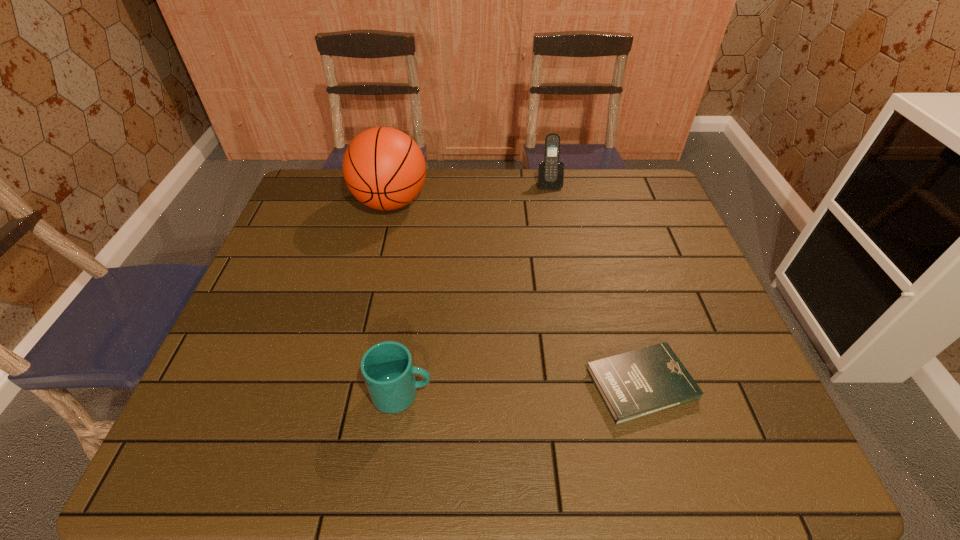
This screenshot has height=540, width=960. I want to click on free space between the cup and the book, so click(x=521, y=389).

You are a GUI agent. You are given a task and a screenshot of the screen. Output one action in this format:
    pyautogui.click(x=<x>, y=<y>)
    Task: Click on the free space between the cup and the basketball
    
    Given the screenshot: What is the action you would take?
    pyautogui.click(x=396, y=298)

The image size is (960, 540). I want to click on vacant area that lies between the tallest object and the cup, so click(x=396, y=298).

Locate an element on the screen. free space between the cellular telephone and the second shortest object is located at coordinates (475, 288).

Image resolution: width=960 pixels, height=540 pixels. Identify the location of unoccupied position between the cup and the tallest object. (396, 298).

The width and height of the screenshot is (960, 540). I want to click on free space between the basketball and the shortest object, so click(516, 293).

The width and height of the screenshot is (960, 540). Identify the location of the third closest object to the third tallest object. (550, 172).

The width and height of the screenshot is (960, 540). Find the location of `object that stands as the third closest to the shortest object`. object that stands as the third closest to the shortest object is located at coordinates (550, 172).

The height and width of the screenshot is (540, 960). I want to click on vacant position in the image that satisfies the following two spatial constraints: 1. on the front-facing side of the shortest object; 2. on the left side of the third shortest object, so click(x=587, y=384).

At what (x,y) coordinates should I click in order to perform the action: click on vacant region that satisfies the following two spatial constraints: 1. on the front-facing side of the cellular telephone; 2. on the handle side of the cup. Please return your answer as a coordinate pair (x, y). The height and width of the screenshot is (540, 960). Looking at the image, I should click on (588, 394).